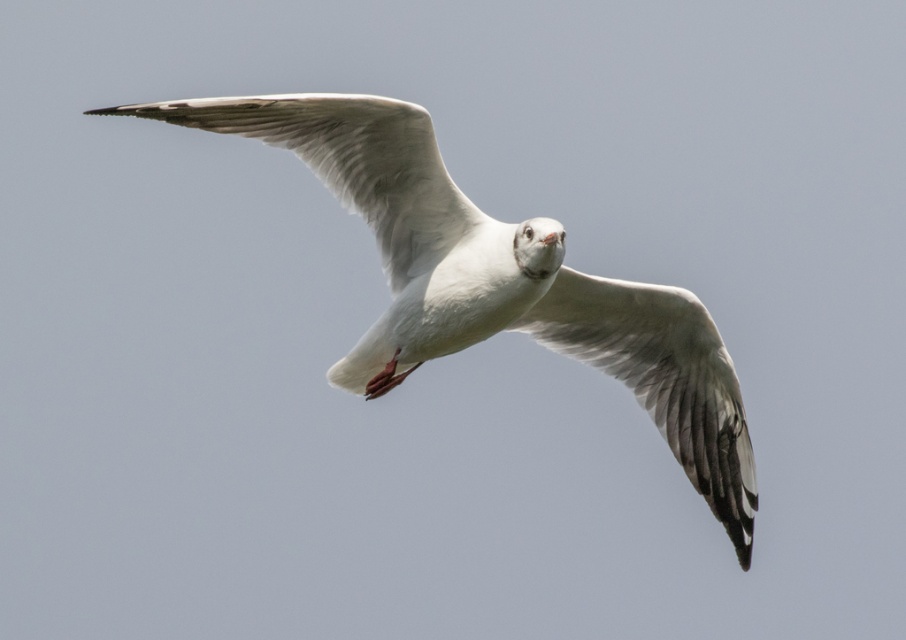
Question: Is white feathered wing at center wider than white feathered wing at upper center?

Choices:
 (A) no
 (B) yes

Answer: (A)

Question: Can you confirm if white feathered bird at center is wider than white feathered wing at center?

Choices:
 (A) no
 (B) yes

Answer: (B)

Question: Which is nearer to the white feathered bird at center?

Choices:
 (A) white feathered wing at center
 (B) white feathered wing at upper center

Answer: (B)

Question: Which object appears closest to the camera in this image?

Choices:
 (A) white feathered bird at center
 (B) white feathered wing at center
 (C) white feathered wing at upper center

Answer: (C)

Question: Which is nearer to the white feathered wing at upper center?

Choices:
 (A) white feathered wing at center
 (B) white feathered bird at center

Answer: (B)

Question: Is white feathered bird at center thinner than white feathered wing at center?

Choices:
 (A) yes
 (B) no

Answer: (B)